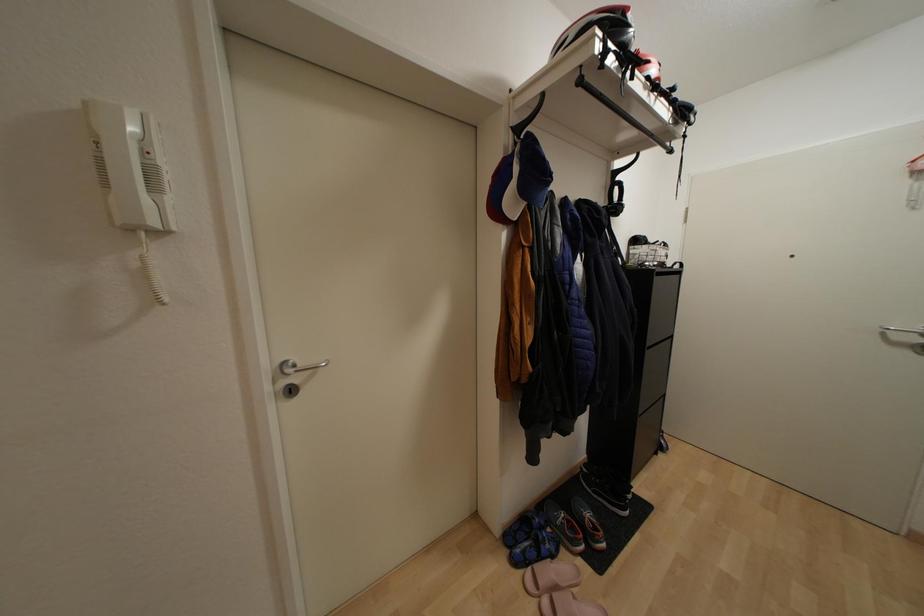
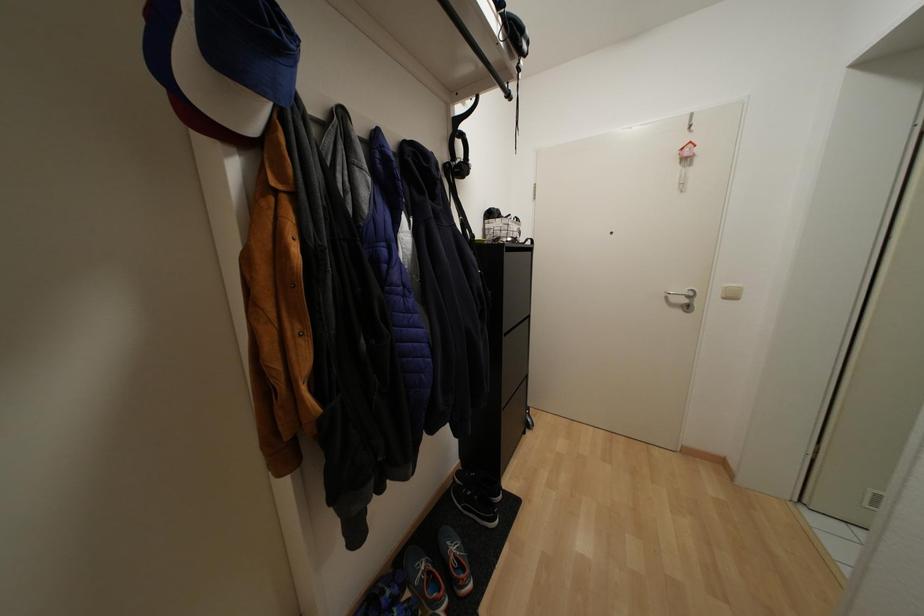
Question: The images are taken continuously from a first-person perspective. In which direction is your viewpoint rotating?

Choices:
 (A) Left
 (B) Right
 (C) Up
 (D) Down

Answer: (B)